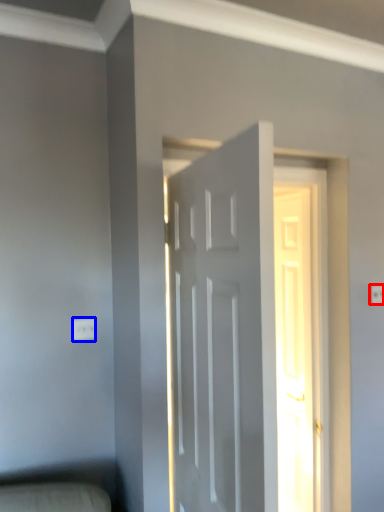
Question: Which object is closer to the camera taking this photo, electric outlet (highlighted by a red box) or electric outlet (highlighted by a blue box)?

Choices:
 (A) electric outlet
 (B) electric outlet

Answer: (B)